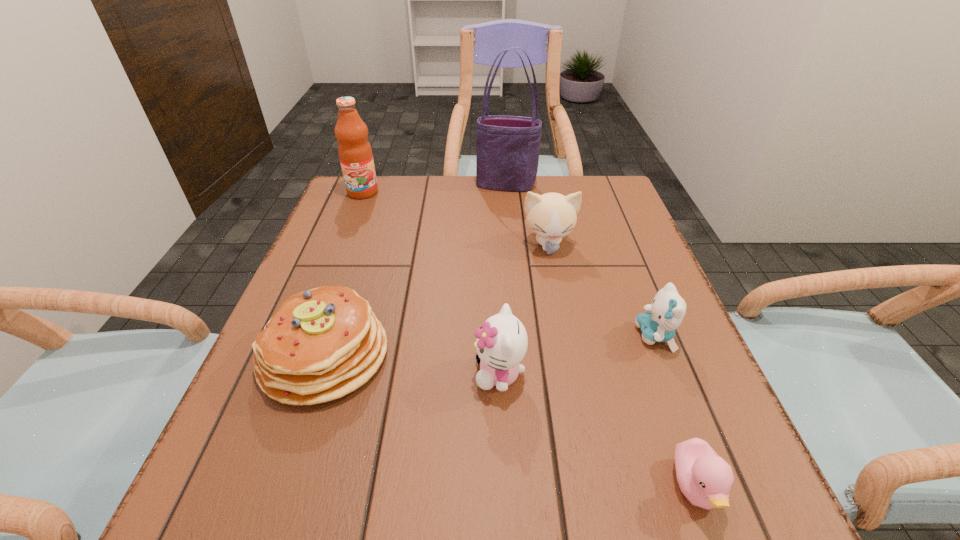
Locate an element on the screen. The image size is (960, 540). free space between the leftmost kitten and the rightmost kitten is located at coordinates (577, 354).

The height and width of the screenshot is (540, 960). I want to click on free area in between the leftmost kitten and the tallest object, so click(503, 279).

Find the location of a particular element. empty space between the leftmost kitten and the second tallest object is located at coordinates point(431,283).

Locate an element on the screen. The height and width of the screenshot is (540, 960). free space between the pancake and the second kitten from right to left is located at coordinates (436, 300).

Find the location of a particular element. object that is the closest to the shortest kitten is located at coordinates (705, 479).

Select which object is the fourth closest to the fruit juice. Please provide its 2D coordinates. Your answer should be formatted as a tuple, i.e. [(x, y)], where the tuple contains the x and y coordinates of a point satisfying the conditions above.

[(501, 344)]

Image resolution: width=960 pixels, height=540 pixels. I want to click on kitten object that ranks as the second closest to the leftmost kitten, so click(551, 216).

Select which kitten appears as the second closest to the sixth shortest object. Please provide its 2D coordinates. Your answer should be formatted as a tuple, i.e. [(x, y)], where the tuple contains the x and y coordinates of a point satisfying the conditions above.

[(501, 344)]

Locate an element on the screen. free region that satisfies the following two spatial constraints: 1. on the front label of the fruit juice; 2. on the left side of the pancake is located at coordinates (300, 355).